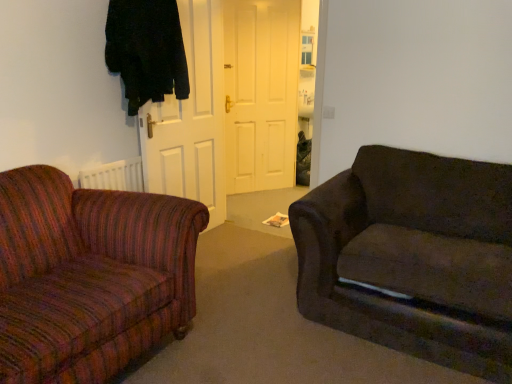
Where is `vacant space that's between dark fabric couch at right and white matte door at center, the 2th door positioned from the back`? The width and height of the screenshot is (512, 384). vacant space that's between dark fabric couch at right and white matte door at center, the 2th door positioned from the back is located at coordinates (239, 276).